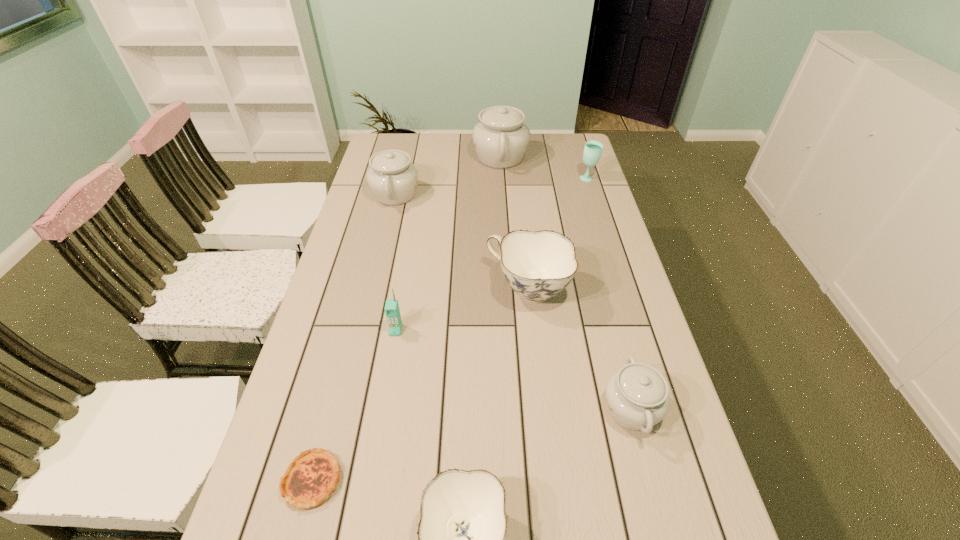
Find the location of a particular element. Image resolution: width=960 pixels, height=540 pixels. the tallest object is located at coordinates (501, 138).

Identify the location of the second white chinaware from left to right. The height and width of the screenshot is (540, 960). (501, 138).

In order to click on the leftmost white chinaware in this screenshot , I will do `click(392, 178)`.

I want to click on the second biggest white chinaware, so click(392, 178).

Identify the location of the bigger blue chinaware. This screenshot has width=960, height=540. (539, 265).

What are the coordinates of `the farther blue chinaware` in the screenshot? It's located at (539, 265).

At what (x,y) coordinates should I click in order to perform the action: click on glass. Please return your answer as a coordinate pair (x, y). This screenshot has height=540, width=960. Looking at the image, I should click on (593, 149).

This screenshot has height=540, width=960. Find the location of `the fourth nearest object`. the fourth nearest object is located at coordinates (392, 311).

Image resolution: width=960 pixels, height=540 pixels. I want to click on the rightmost chinaware, so click(637, 396).

The width and height of the screenshot is (960, 540). What are the coordinates of `the nearest white chinaware` in the screenshot? It's located at (637, 396).